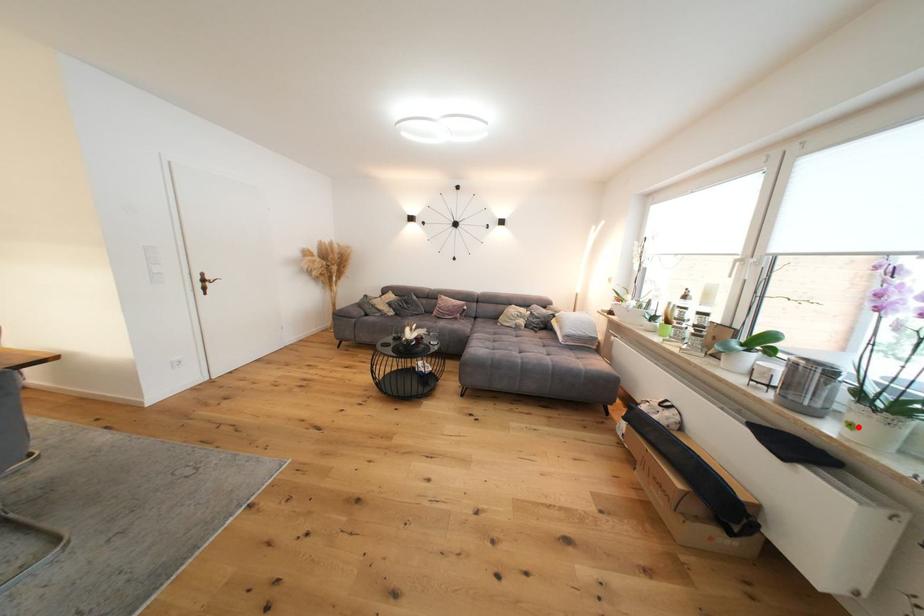
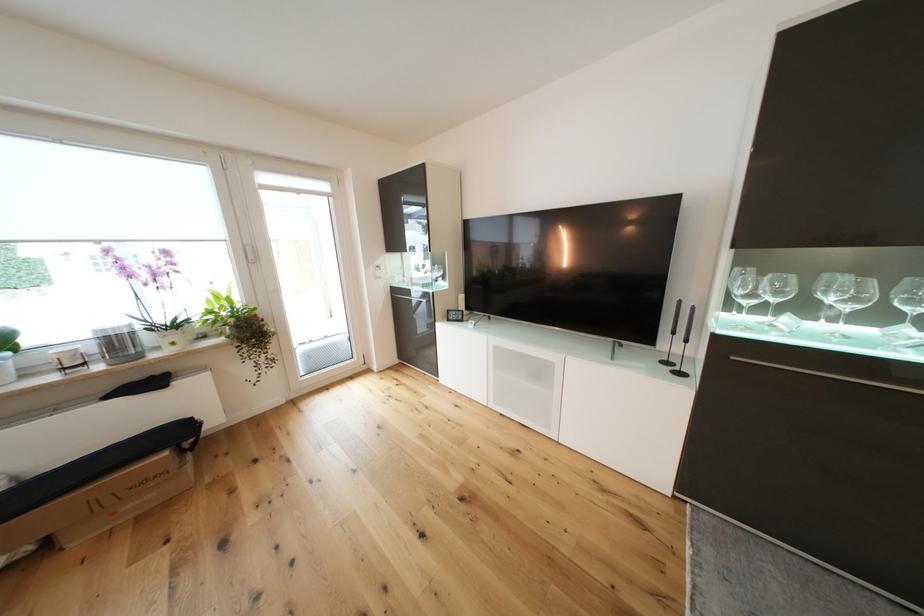
The point at the highlighted location is marked in the first image. Where is the corresponding point in the second image?

(180, 345)